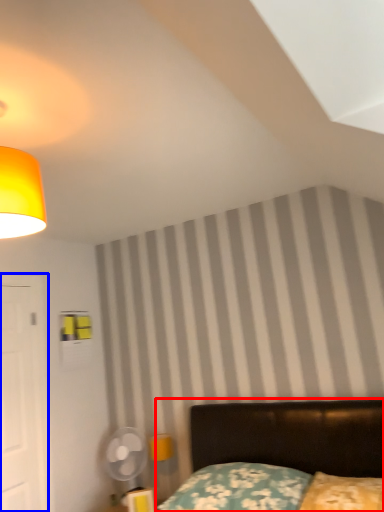
Question: Which point is closer to the camera, bed (highlighted by a red box) or door (highlighted by a blue box)?

Choices:
 (A) bed
 (B) door

Answer: (A)